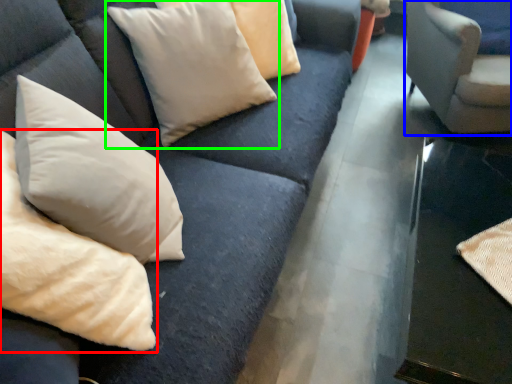
Question: Which is farther away from pillow (highlighted by a red box)? chair (highlighted by a blue box) or pillow (highlighted by a green box)?

Choices:
 (A) chair
 (B) pillow

Answer: (A)